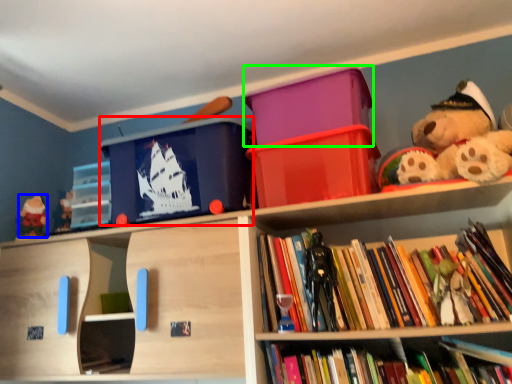
Question: Which object is the closest to the storage box (highlighted by a red box)? Choose among these: toy (highlighted by a blue box) or storage box (highlighted by a green box).

Choices:
 (A) toy
 (B) storage box

Answer: (B)